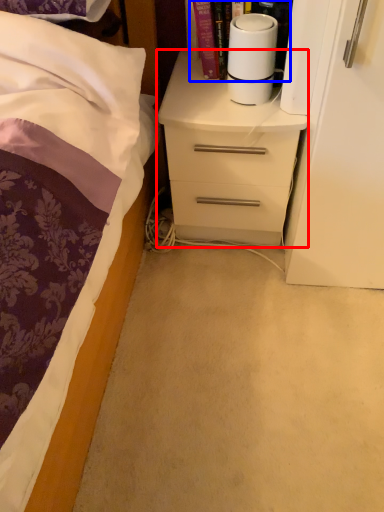
Question: Which of the following is the farthest to the observer, chest of drawers (highlighted by a red box) or book (highlighted by a blue box)?

Choices:
 (A) chest of drawers
 (B) book

Answer: (A)